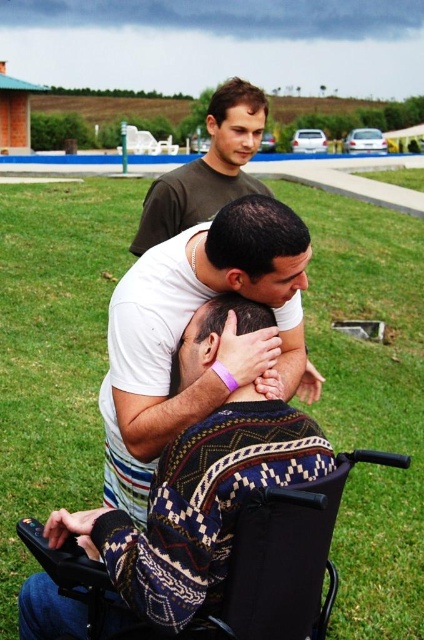
From the picture: Measure the distance from black plastic wheelchair at lower left to matte brown shirt at upper center.

The distance of black plastic wheelchair at lower left from matte brown shirt at upper center is 38.96 inches.

Who is positioned more to the left, black plastic wheelchair at lower left or matte brown shirt at upper center?

matte brown shirt at upper center

Between point (231, 605) and point (204, 166), which one is positioned in front?

Positioned in front is point (231, 605).

Where is `black plastic wheelchair at lower left`? black plastic wheelchair at lower left is located at coordinates (279, 561).

Does knitted sweater at center have a greater width compared to matte brown shirt at upper center?

No, knitted sweater at center is not wider than matte brown shirt at upper center.

Can you confirm if knitted sweater at center is positioned to the right of matte brown shirt at upper center?

Indeed, knitted sweater at center is positioned on the right side of matte brown shirt at upper center.

Is point (144, 536) behind point (203, 180)?

No, (144, 536) is closer to viewer.

I want to click on knitted sweater at center, so click(197, 506).

Which is above, white soft t-shirt at center or matte brown shirt at upper center?

matte brown shirt at upper center is higher up.

How far apart are white soft t-shirt at center and matte brown shirt at upper center?

white soft t-shirt at center is 26.81 inches away from matte brown shirt at upper center.

Does point (194, 234) come in front of point (226, 124)?

Yes.

At what (x,y) coordinates should I click in order to perform the action: click on white soft t-shirt at center. Please return your answer as a coordinate pair (x, y). Looking at the image, I should click on [x=184, y=328].